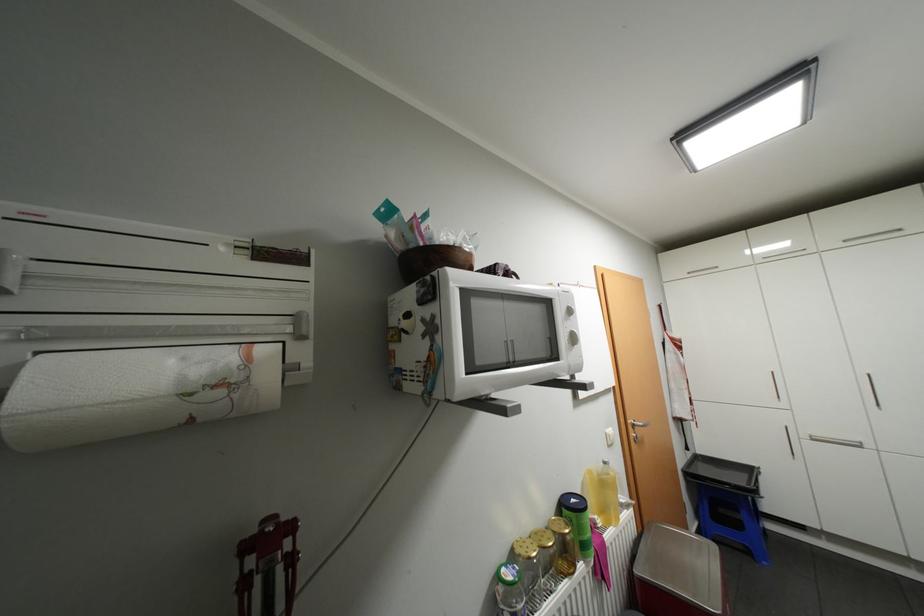
This screenshot has height=616, width=924. Describe the element at coordinates (602, 493) in the screenshot. I see `the large yellow bottle` at that location.